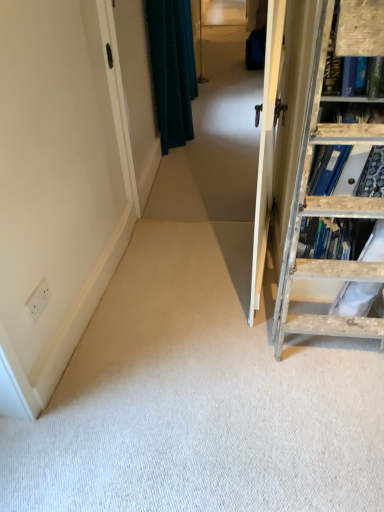
Question: Should I look upward or downward to see wooden ladder at right?

Choices:
 (A) down
 (B) up

Answer: (B)

Question: Is teal velvet curtain at upper center turned away from teal fabric curtain at upper left?

Choices:
 (A) no
 (B) yes

Answer: (A)

Question: From the image's perspective, does teal velvet curtain at upper center appear higher than teal fabric curtain at upper left?

Choices:
 (A) no
 (B) yes

Answer: (B)

Question: From the image's perspective, is teal velvet curtain at upper center beneath teal fabric curtain at upper left?

Choices:
 (A) yes
 (B) no

Answer: (B)

Question: Would you consider teal velvet curtain at upper center to be distant from teal fabric curtain at upper left?

Choices:
 (A) yes
 (B) no

Answer: (B)

Question: Is the surface of teal velvet curtain at upper center in direct contact with teal fabric curtain at upper left?

Choices:
 (A) no
 (B) yes

Answer: (A)

Question: Does teal velvet curtain at upper center have a greater width compared to teal fabric curtain at upper left?

Choices:
 (A) no
 (B) yes

Answer: (B)

Question: Does teal fabric curtain at upper left lie behind wooden ladder at right?

Choices:
 (A) yes
 (B) no

Answer: (A)

Question: From the image's perspective, would you say teal fabric curtain at upper left is shown under wooden ladder at right?

Choices:
 (A) no
 (B) yes

Answer: (A)

Question: Can you confirm if teal fabric curtain at upper left is positioned to the right of wooden ladder at right?

Choices:
 (A) no
 (B) yes

Answer: (A)

Question: Can you confirm if teal fabric curtain at upper left is bigger than wooden ladder at right?

Choices:
 (A) yes
 (B) no

Answer: (B)

Question: Can you see teal fabric curtain at upper left touching wooden ladder at right?

Choices:
 (A) yes
 (B) no

Answer: (B)

Question: Can you confirm if teal fabric curtain at upper left is positioned to the left of wooden ladder at right?

Choices:
 (A) no
 (B) yes

Answer: (B)

Question: Is teal velvet curtain at upper center with wooden ladder at right?

Choices:
 (A) no
 (B) yes

Answer: (A)